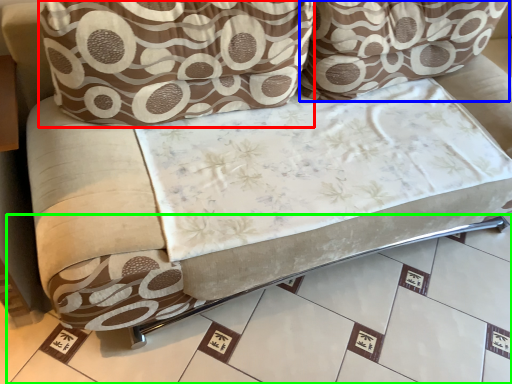
Question: Estimate the real-world distances between objects in this image. Which object is farther from throw pillow (highlighted by a red box), throw pillow (highlighted by a blue box) or tile (highlighted by a green box)?

Choices:
 (A) throw pillow
 (B) tile

Answer: (B)